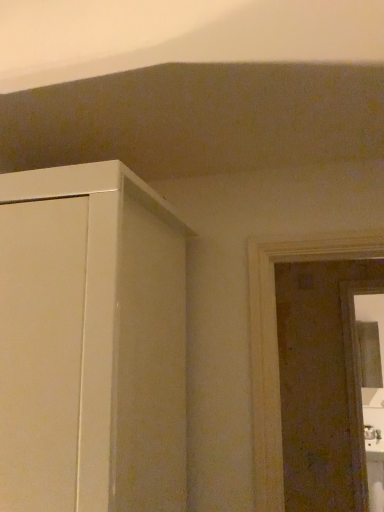
What do you see at coordinates (374, 445) in the screenshot? Image resolution: width=384 pixels, height=512 pixels. I see `white glossy sink at lower right` at bounding box center [374, 445].

Identify the location of white glossy sink at lower right. (374, 445).

Image resolution: width=384 pixels, height=512 pixels. Find the location of `white glossy sink at lower right`. white glossy sink at lower right is located at coordinates (374, 445).